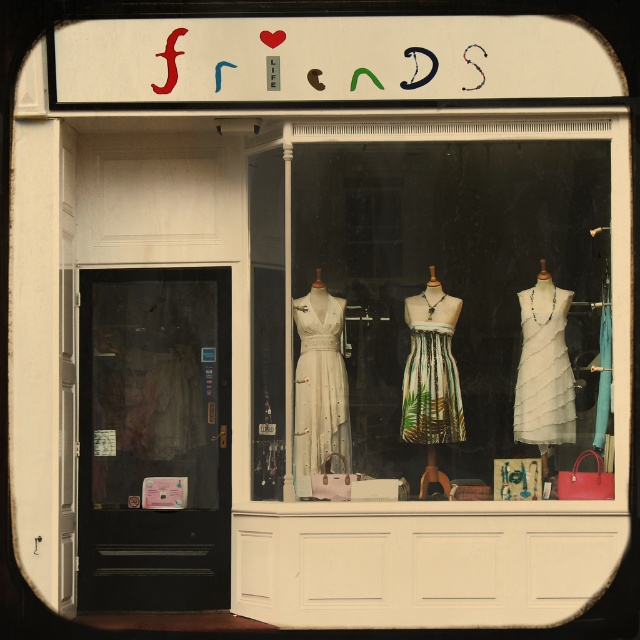
You are a customer looking at the dresses displayed in the window of the boutique named friends. You see a white fabric dress at center and a printed fabric dress at center. Which dress is displayed higher up?

The white fabric dress at center is displayed higher up because it is above the printed fabric dress at center.

You are a customer looking at the store window display. Where exactly is the white fabric dress at center located in the window display?

The white fabric dress at center is located at point (435, 310) in the window display.

You are a customer looking at the dresses displayed in the window of the boutique named friends. You see a white fabric dress at center and a printed fabric dress at center. Which dress is easier to see from the street?

The white fabric dress at center is closer to the viewer than the printed fabric dress at center, so the white fabric dress at center is easier to see from the street.